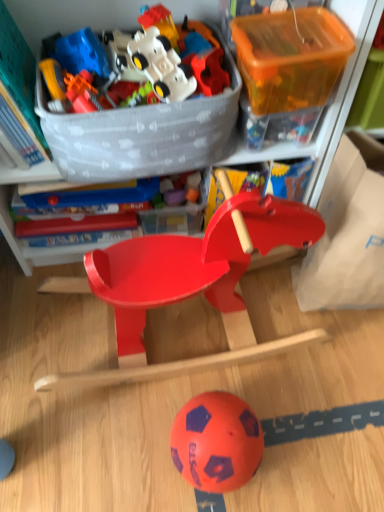
This screenshot has height=512, width=384. What are the coordinates of `free space behind orange rubber ball at lower center` in the screenshot? It's located at coord(206,371).